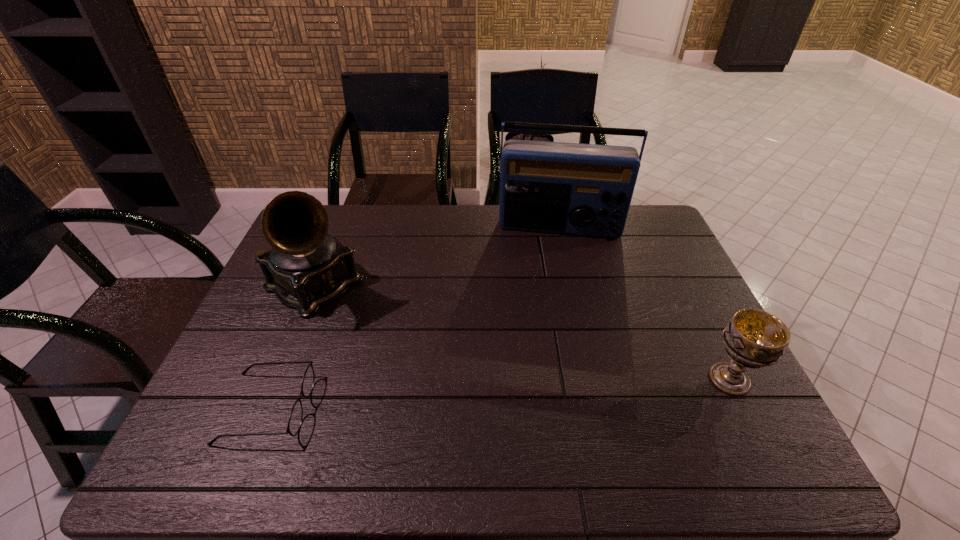
The height and width of the screenshot is (540, 960). In order to click on empty space between the second shortest object and the shortest object in this screenshot , I will do `click(498, 394)`.

Locate an element on the screen. The width and height of the screenshot is (960, 540). free space that is in between the chalice and the farthest object is located at coordinates (645, 303).

I want to click on free point between the second object from right to left and the second farthest object, so click(437, 258).

The image size is (960, 540). What are the coordinates of `vacant space in between the third tallest object and the second farthest object` in the screenshot? It's located at (521, 333).

Identify the location of free space between the second farthest object and the spectacles. The height and width of the screenshot is (540, 960). (290, 347).

Find the location of a particular element. Image resolution: width=960 pixels, height=540 pixels. empty location between the second farthest object and the spectacles is located at coordinates (290, 347).

Identify the location of empty location between the third nearest object and the second shortest object. pyautogui.click(x=521, y=333).

Find the location of a particular element. This screenshot has height=540, width=960. empty space between the spectacles and the third nearest object is located at coordinates (290, 347).

Image resolution: width=960 pixels, height=540 pixels. Identify the location of unoccupied position between the shortest object and the chalice. (498, 394).

I want to click on object that stands as the closest to the chalice, so click(x=554, y=187).